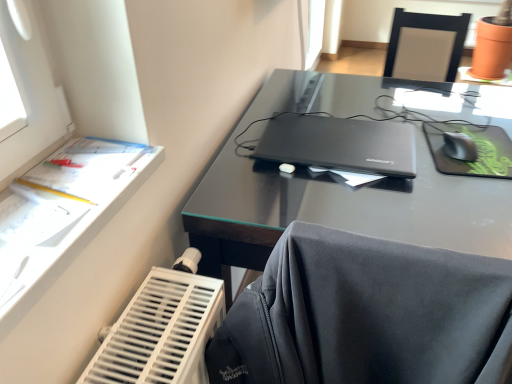
The image size is (512, 384). What are the coordinates of `vacant space to the right of matte black laptop at center` in the screenshot? It's located at (x=438, y=140).